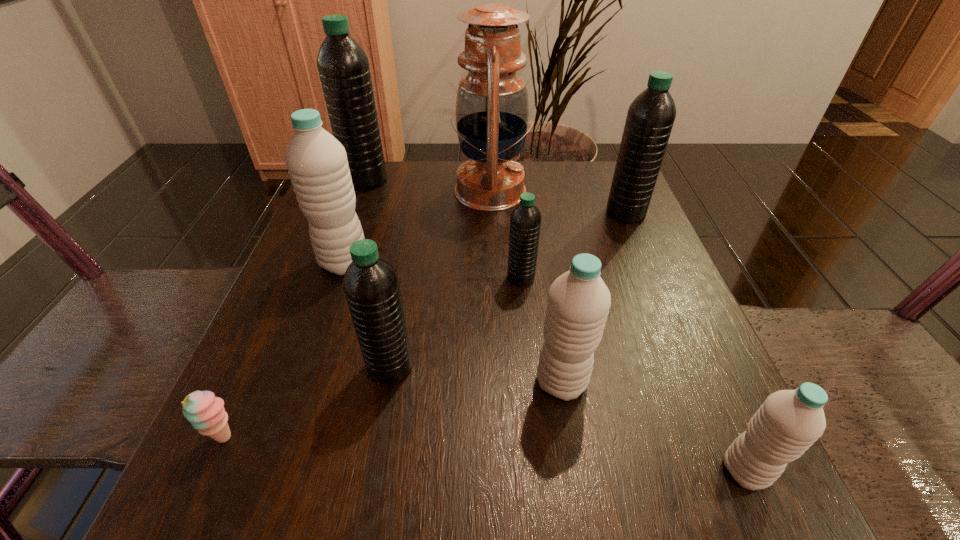
Where is `blue oil lamp`? This screenshot has width=960, height=540. blue oil lamp is located at coordinates (492, 107).

Where is `the farthest water bottle`? This screenshot has width=960, height=540. the farthest water bottle is located at coordinates (343, 66).

Identify the location of the leftmost black water bottle. This screenshot has width=960, height=540. (343, 66).

I want to click on the farthest white water bottle, so click(x=317, y=164).

I want to click on the leftmost white water bottle, so click(317, 164).

At what (x,y) coordinates should I click in order to perform the action: click on the third smallest black water bottle. Please return your answer as a coordinate pair (x, y). Looking at the image, I should click on (650, 117).

The height and width of the screenshot is (540, 960). Identify the location of the rightmost black water bottle. (650, 117).

At what (x,y) coordinates should I click in order to perform the action: click on the fifth water bottle from right to left. Please return your answer as a coordinate pair (x, y). Image resolution: width=960 pixels, height=540 pixels. Looking at the image, I should click on (371, 286).

You are a GUI agent. You are given a task and a screenshot of the screen. Output one action in this format:
    pyautogui.click(x=<x>, y=<y>)
    Task: Click on the third biggest black water bottle
    The height and width of the screenshot is (540, 960).
    Given the screenshot: What is the action you would take?
    pyautogui.click(x=371, y=286)

You are a GUI agent. You are given a task and a screenshot of the screen. Output one action in this format:
    pyautogui.click(x=<x>, y=<y>)
    Task: Click on the second biggest white water bottle
    
    Given the screenshot: What is the action you would take?
    pyautogui.click(x=578, y=304)